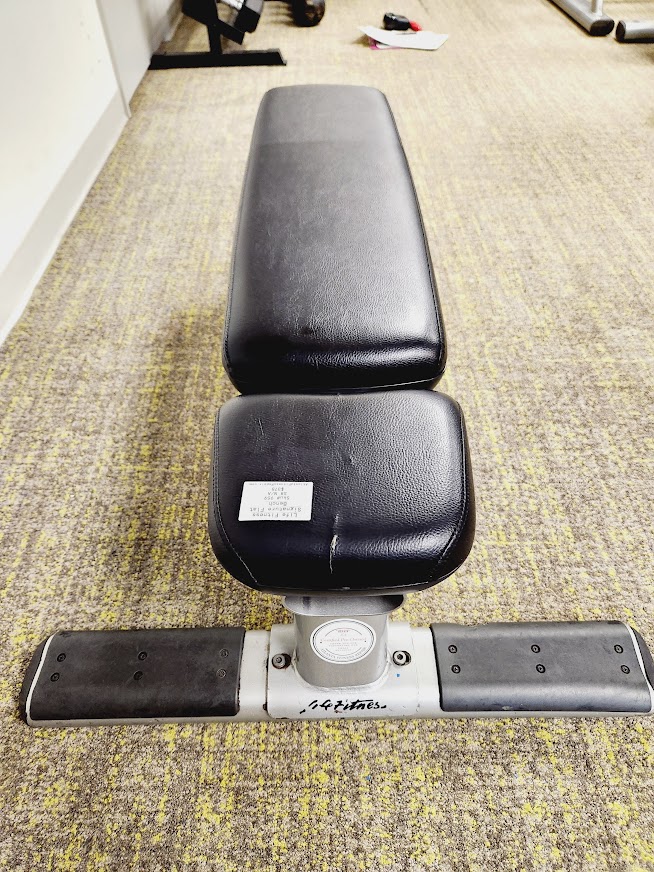
The image size is (654, 872). In order to click on front cushion in this screenshot , I will do `click(346, 458)`.